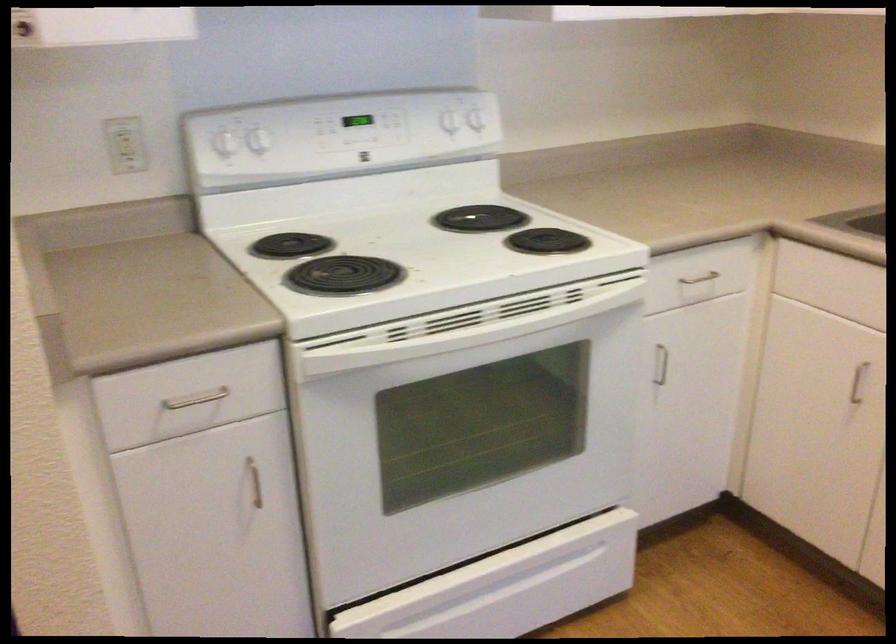
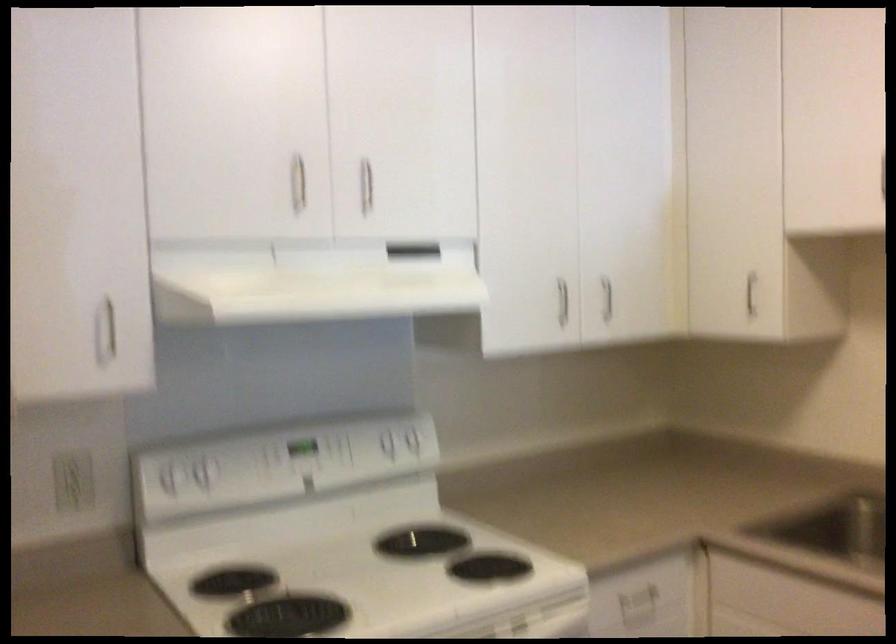
Where in the second image is the point corresponding to pixel 448 116 from the first image?

(385, 440)